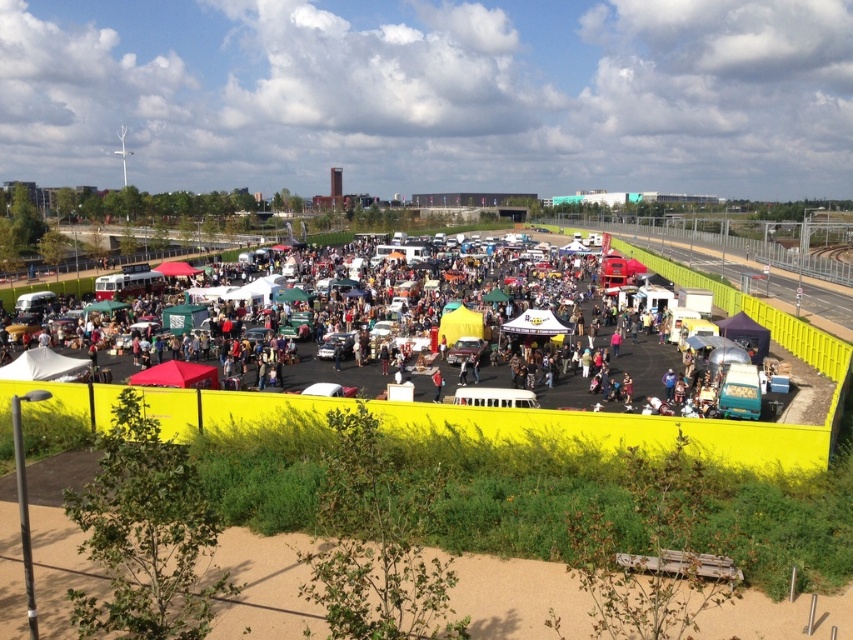
Is point (48, 362) positioned behind point (184, 362)?

Yes, it is.

Does white fabric canopy at lower left have a lesser height compared to matte red canopy at lower left?

Yes, white fabric canopy at lower left is shorter than matte red canopy at lower left.

Is point (79, 369) closer to camera compared to point (189, 380)?

No, (79, 369) is behind (189, 380).

The height and width of the screenshot is (640, 853). I want to click on white fabric canopy at lower left, so pyautogui.click(x=41, y=365).

Is point (200, 403) closer to camera compared to point (187, 385)?

Yes, it is in front of point (187, 385).

I want to click on matte black tent at center, so click(x=785, y=348).

The image size is (853, 640). Identify the location of matte black tent at center. (785, 348).

Is white fabric canopy at lower left positioned in front of white fabric canopy at center?

Yes, white fabric canopy at lower left is closer to the viewer.

Between point (77, 362) and point (548, 326), which one is positioned in front?

Point (77, 362)

Where is `white fabric canopy at lower left`? This screenshot has width=853, height=640. white fabric canopy at lower left is located at coordinates (41, 365).